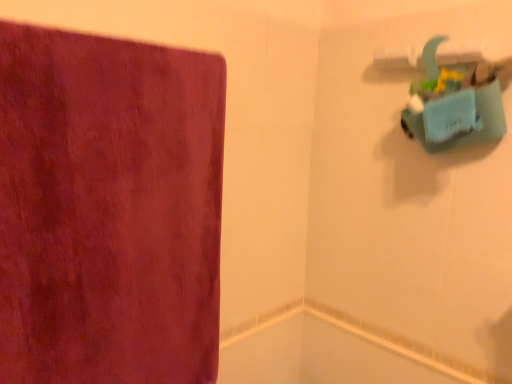
Question: Does velvet-like maroon towel at left turn towards white glossy bath at lower center?

Choices:
 (A) no
 (B) yes

Answer: (A)

Question: Does velvet-like maroon towel at left have a greater height compared to white glossy bath at lower center?

Choices:
 (A) yes
 (B) no

Answer: (A)

Question: Can you confirm if velvet-like maroon towel at left is positioned to the left of white glossy bath at lower center?

Choices:
 (A) no
 (B) yes

Answer: (B)

Question: Is velvet-like maroon towel at left shorter than white glossy bath at lower center?

Choices:
 (A) yes
 (B) no

Answer: (B)

Question: From a real-world perspective, is velvet-like maroon towel at left beneath white glossy bath at lower center?

Choices:
 (A) no
 (B) yes

Answer: (A)

Question: Is velvet-like maroon towel at left positioned beyond the bounds of white glossy bath at lower center?

Choices:
 (A) no
 (B) yes

Answer: (B)

Question: Is the depth of white glossy bath at lower center less than that of velvet-like maroon towel at left?

Choices:
 (A) yes
 (B) no

Answer: (B)

Question: Is white glossy bath at lower center placed right next to velvet-like maroon towel at left?

Choices:
 (A) yes
 (B) no

Answer: (B)

Question: Can you confirm if white glossy bath at lower center is taller than velvet-like maroon towel at left?

Choices:
 (A) yes
 (B) no

Answer: (B)

Question: From the image's perspective, is white glossy bath at lower center below velvet-like maroon towel at left?

Choices:
 (A) no
 (B) yes

Answer: (B)

Question: Is white glossy bath at lower center turned away from velvet-like maroon towel at left?

Choices:
 (A) yes
 (B) no

Answer: (B)

Question: Does white glossy bath at lower center have a larger size compared to velvet-like maroon towel at left?

Choices:
 (A) no
 (B) yes

Answer: (A)

Question: Would you say velvet-like maroon towel at left is to the left or to the right of white glossy bath at lower center in the picture?

Choices:
 (A) left
 (B) right

Answer: (A)